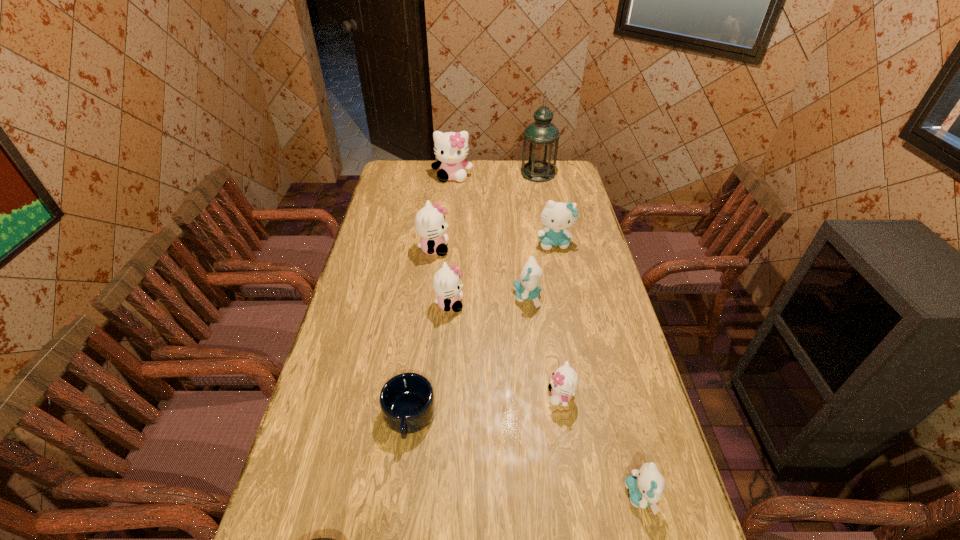
Identify the location of the smallest white kitten. (564, 381).

The width and height of the screenshot is (960, 540). Find the location of `the nearest blue kitten`. the nearest blue kitten is located at coordinates (646, 486).

Find the location of a particular element. The width and height of the screenshot is (960, 540). the nearest kitten is located at coordinates (646, 486).

You are a GUI agent. You are given a task and a screenshot of the screen. Output one action in this format:
    pyautogui.click(x=<x>, y=<y>)
    Task: Click on the blue mug
    
    Given the screenshot: What is the action you would take?
    pyautogui.click(x=407, y=401)

Identify the location of the shortest object. (407, 401).

At what (x,y) coordinates should I click in order to perform the action: click on vacant area situated on the front of the tallest object. Please return your answer as a coordinate pair (x, y). The height and width of the screenshot is (540, 960). Looking at the image, I should click on (549, 231).

This screenshot has width=960, height=540. In order to click on vacant point located 0.300m on the front-facing side of the biggest white kitten in this screenshot , I will do `click(448, 221)`.

Locate an element on the screen. This screenshot has width=960, height=540. vacant area situated 0.220m on the front-facing side of the second farthest white kitten is located at coordinates coord(506,249).

Identify the location of vacant space located 0.180m on the face of the farthest blue kitten. (563, 285).

At what (x,y) coordinates should I click in order to perform the action: click on free region located 0.230m on the face of the second nearest blue kitten. Please return your answer as a coordinate pair (x, y). This screenshot has height=540, width=960. Looking at the image, I should click on (447, 296).